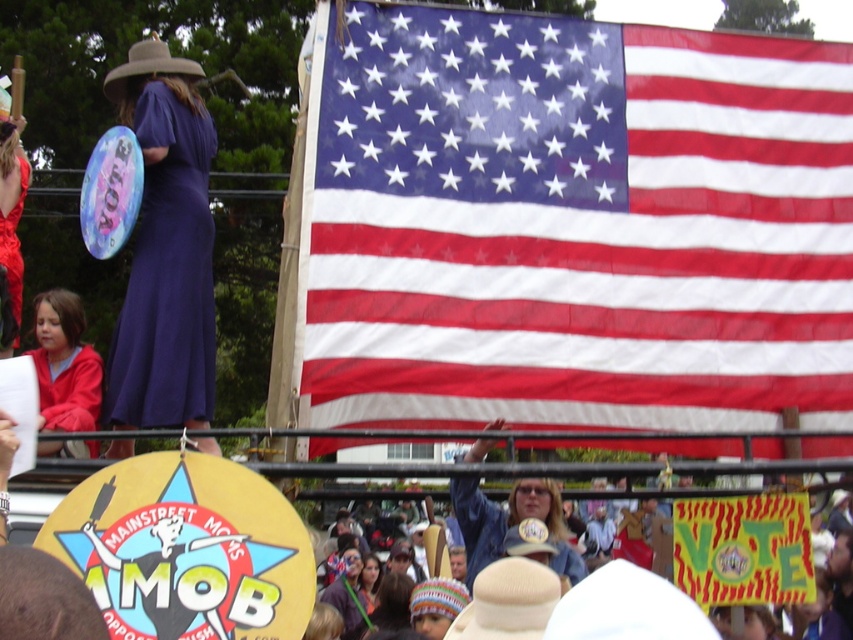
Can you confirm if red-white-and-blue fabric at upper center is taller than purple matte dress at left?

Correct, red-white-and-blue fabric at upper center is much taller as purple matte dress at left.

Which is above, red-white-and-blue fabric at upper center or purple matte dress at left?

red-white-and-blue fabric at upper center is above.

Where is `red-white-and-blue fabric at upper center`? The height and width of the screenshot is (640, 853). red-white-and-blue fabric at upper center is located at coordinates (576, 227).

Who is shorter, red-white-and-blue fabric at upper center or matte purple dress at upper left?

matte purple dress at upper left

Is red-white-and-blue fabric at upper center to the right of matte purple dress at upper left from the viewer's perspective?

Yes, red-white-and-blue fabric at upper center is to the right of matte purple dress at upper left.

Is point (668, 160) farther from viewer compared to point (16, 294)?

Yes, point (668, 160) is behind point (16, 294).

Where is `red-white-and-blue fabric at upper center`? The image size is (853, 640). red-white-and-blue fabric at upper center is located at coordinates (576, 227).

Who is positioned more to the left, red-white-and-blue fabric at upper center or red fleece jacket at left?

red fleece jacket at left

What are the coordinates of `red-white-and-blue fabric at upper center` in the screenshot? It's located at (576, 227).